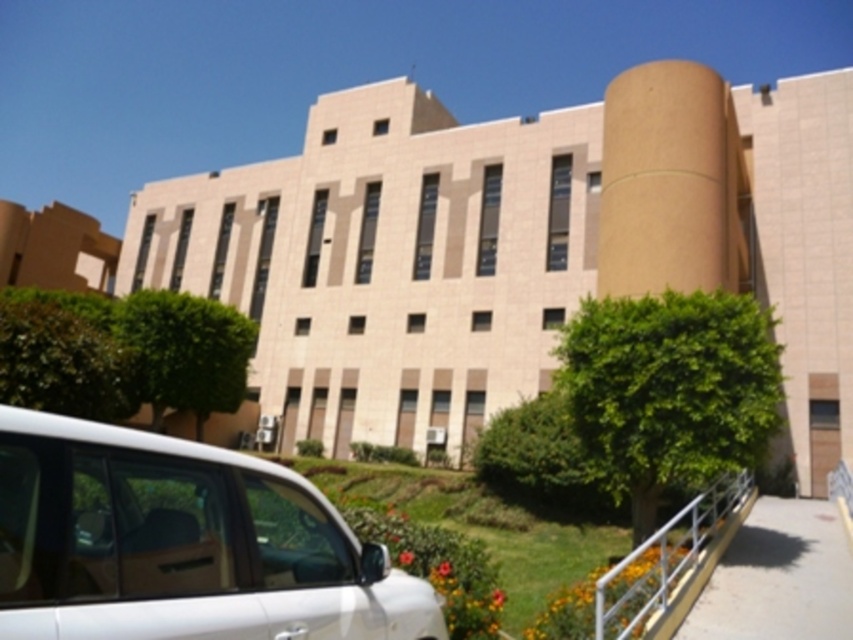
Question: Which point is closer to the camera taking this photo?

Choices:
 (A) (303, 502)
 (B) (648, 556)

Answer: (A)

Question: Does white matte van at lower left appear on the left side of white metal railing at lower right?

Choices:
 (A) no
 (B) yes

Answer: (B)

Question: Which object is closer to the camera taking this photo?

Choices:
 (A) white metal railing at lower right
 (B) white matte van at lower left

Answer: (B)

Question: Does white matte van at lower left have a smaller size compared to white metal railing at lower right?

Choices:
 (A) no
 (B) yes

Answer: (B)

Question: Is white matte van at lower left to the left of white metal railing at lower right from the viewer's perspective?

Choices:
 (A) no
 (B) yes

Answer: (B)